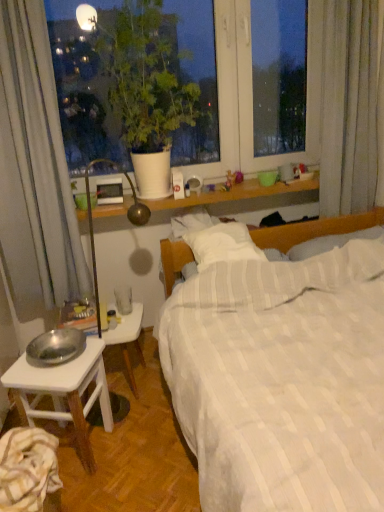
Question: Can you confirm if white wooden table at lower left is smaller than white matte plant pot at upper left?

Choices:
 (A) no
 (B) yes

Answer: (B)

Question: From a real-world perspective, is white wooden table at lower left beneath white matte plant pot at upper left?

Choices:
 (A) yes
 (B) no

Answer: (A)

Question: Is the position of white wooden table at lower left more distant than that of white matte plant pot at upper left?

Choices:
 (A) no
 (B) yes

Answer: (B)

Question: Can you confirm if white wooden table at lower left is wider than white matte plant pot at upper left?

Choices:
 (A) no
 (B) yes

Answer: (A)

Question: Is white wooden table at lower left looking in the opposite direction of white matte plant pot at upper left?

Choices:
 (A) no
 (B) yes

Answer: (A)

Question: Are white wooden table at lower left and white matte plant pot at upper left located far from each other?

Choices:
 (A) no
 (B) yes

Answer: (A)

Question: Is white matte plant pot at upper left far from striped cotton sheet at lower left?

Choices:
 (A) yes
 (B) no

Answer: (A)

Question: Does white matte plant pot at upper left have a greater width compared to striped cotton sheet at lower left?

Choices:
 (A) no
 (B) yes

Answer: (B)

Question: Considering the relative sizes of white matte plant pot at upper left and striped cotton sheet at lower left in the image provided, is white matte plant pot at upper left bigger than striped cotton sheet at lower left?

Choices:
 (A) no
 (B) yes

Answer: (B)

Question: Can you see white matte plant pot at upper left touching striped cotton sheet at lower left?

Choices:
 (A) no
 (B) yes

Answer: (A)

Question: Is white matte plant pot at upper left taller than striped cotton sheet at lower left?

Choices:
 (A) no
 (B) yes

Answer: (B)

Question: Can you confirm if white matte plant pot at upper left is shorter than striped cotton sheet at lower left?

Choices:
 (A) yes
 (B) no

Answer: (B)

Question: Is white wooden table at lower left bigger than silver metallic bowl at lower left?

Choices:
 (A) yes
 (B) no

Answer: (B)